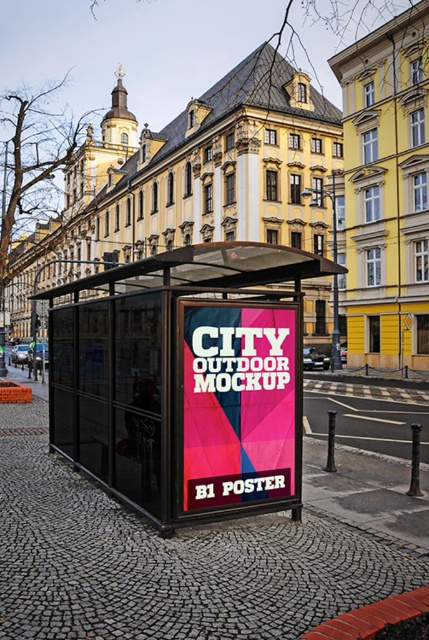
Question: Among these objects, which one is nearest to the camera?

Choices:
 (A) metallic glass bus stop at center
 (B) matte pink poster at center

Answer: (B)

Question: Does metallic glass bus stop at center appear over matte pink poster at center?

Choices:
 (A) no
 (B) yes

Answer: (B)

Question: Among these points, which one is nearest to the camera?

Choices:
 (A) (271, 355)
 (B) (221, 420)

Answer: (B)

Question: In this image, where is metallic glass bus stop at center located relative to matte pink poster at center?

Choices:
 (A) left
 (B) right

Answer: (B)

Question: Can you confirm if metallic glass bus stop at center is positioned to the right of matte pink poster at center?

Choices:
 (A) yes
 (B) no

Answer: (A)